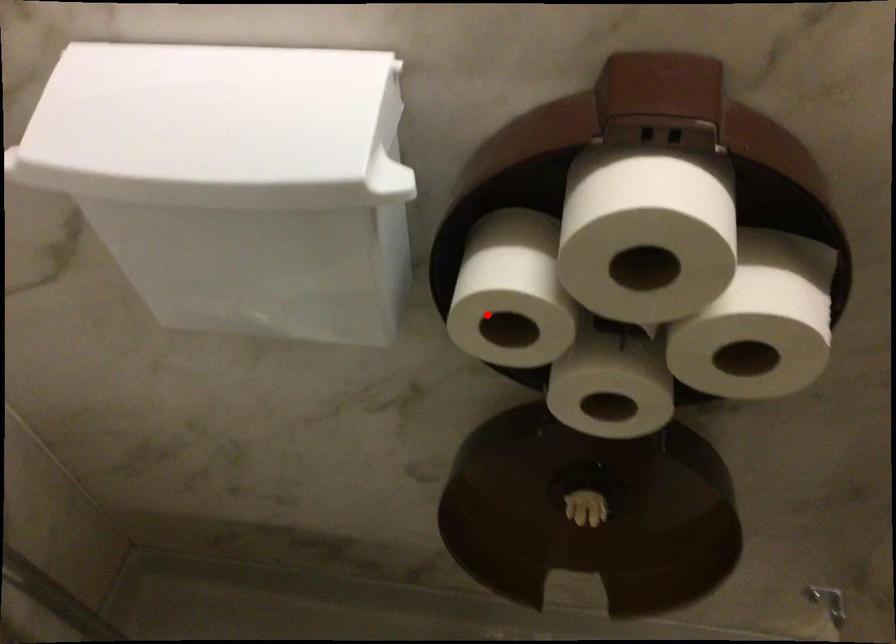
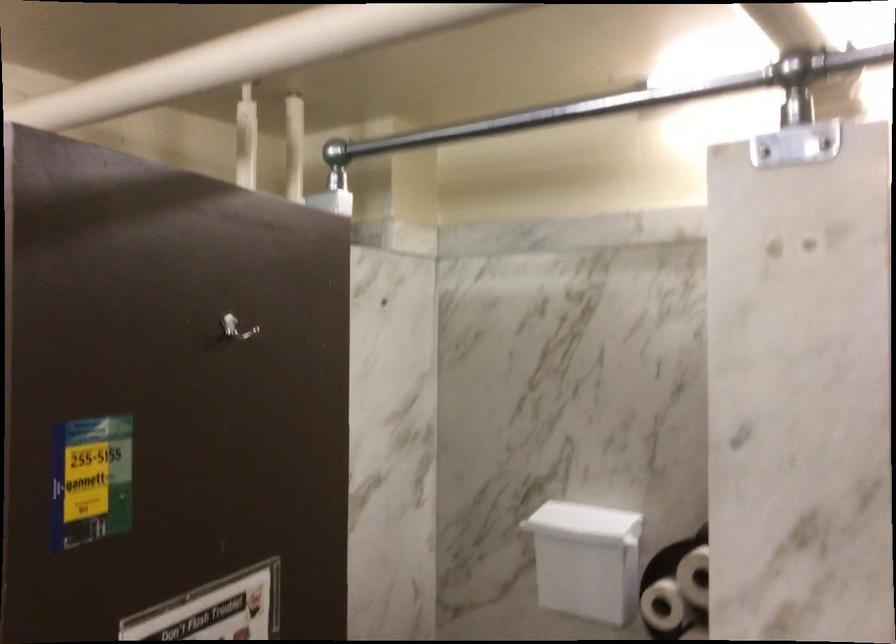
Question: A red point is marked in image1. In image2, is the corresponding 3D point closer to the camera or farther? Reply with the corresponding letter.

Choices:
 (A) The corresponding 3D point is closer.
 (B) The corresponding 3D point is farther.

Answer: (B)